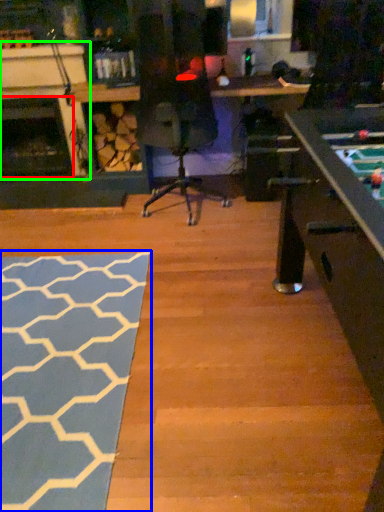
Question: Which object is the closest to the fireplace (highlighted by a red box)? Choose among these: mat (highlighted by a blue box) or fireplace (highlighted by a green box).

Choices:
 (A) mat
 (B) fireplace

Answer: (B)